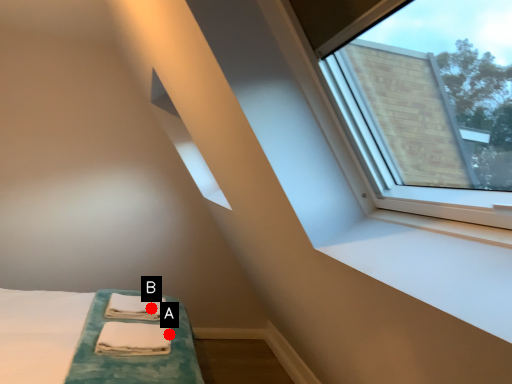
Question: Two points are circled on the image, labeled by A and B beside each circle. Which point is closer to the camera?

Choices:
 (A) A is closer
 (B) B is closer

Answer: (A)